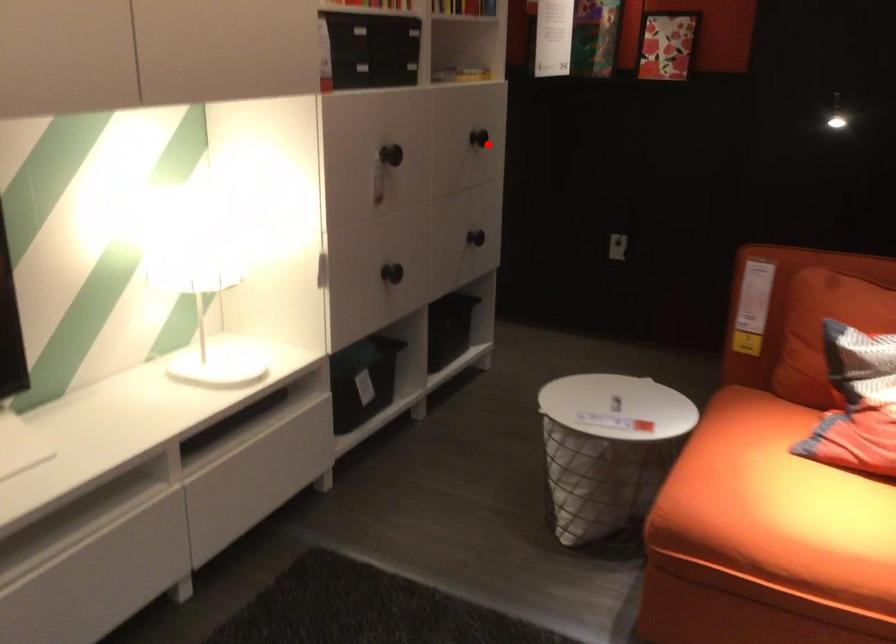
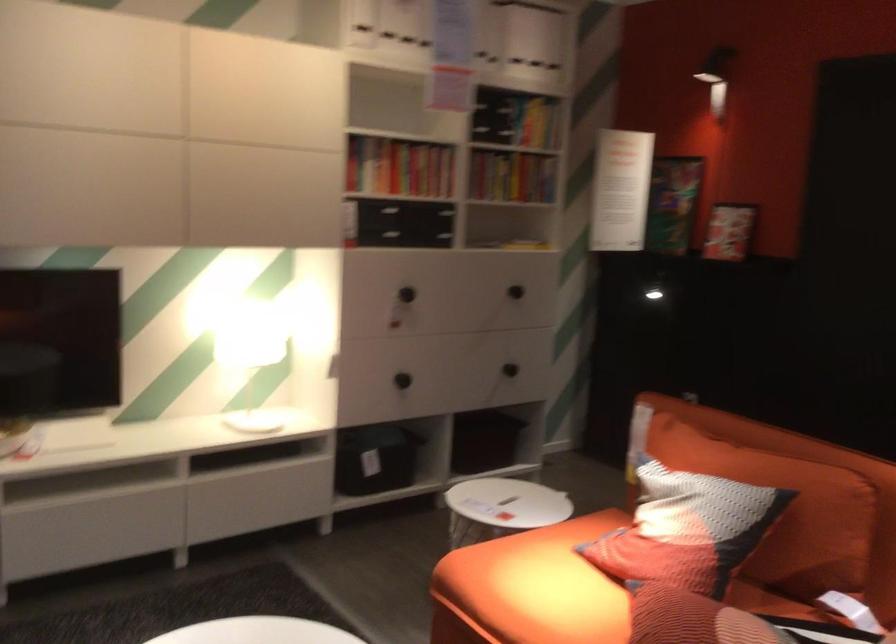
The point at the highlighted location is marked in the first image. Where is the corresponding point in the second image?

(514, 292)